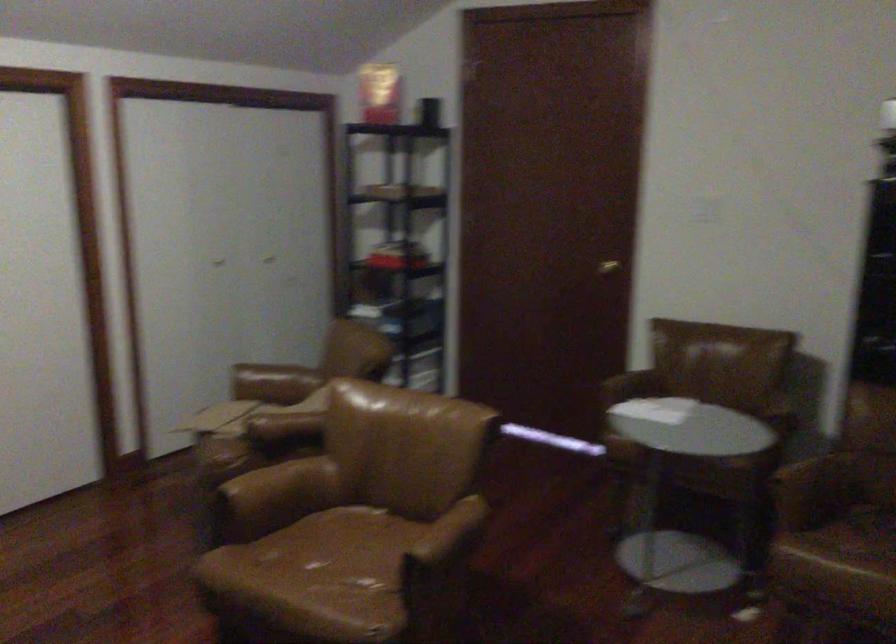
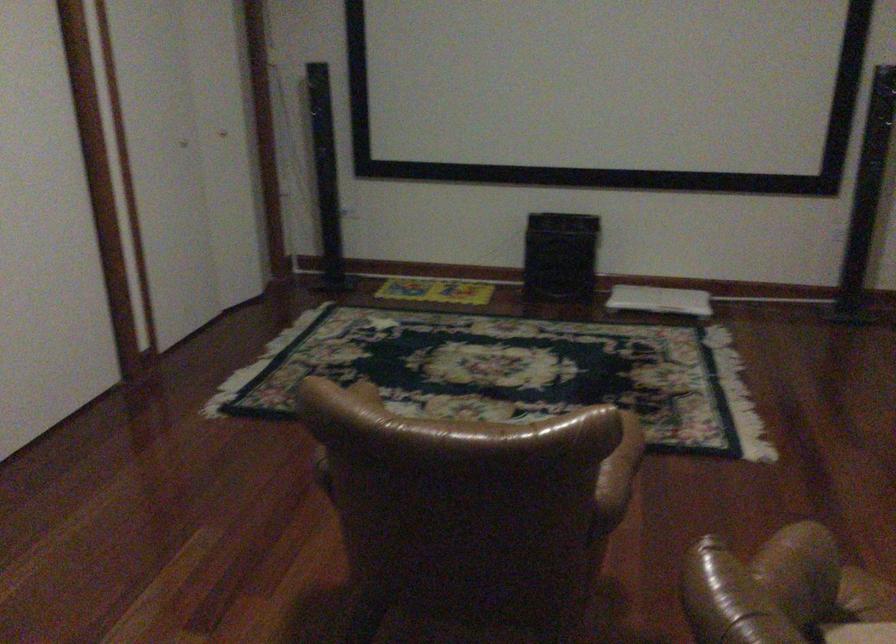
Question: I am providing you with two images of the same scene from different viewpoints. After the viewpoint changes to image2, which objects are now occluded?

Choices:
 (A) brown leather armrest
 (B) blue button
 (C) brown chair armrest
 (D) black speaker box

Answer: (C)